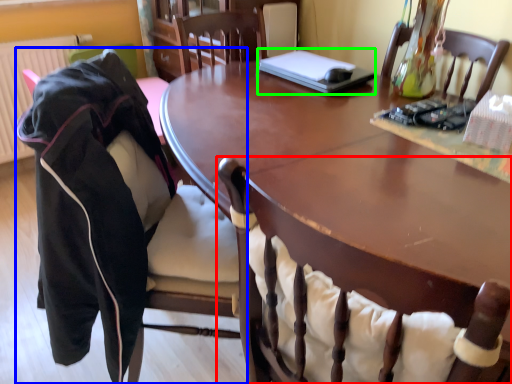
Question: Which object is positioned closest to chair (highlighted by a red box)? Select from chair (highlighted by a blue box) and laptop (highlighted by a green box).

Choices:
 (A) chair
 (B) laptop

Answer: (A)